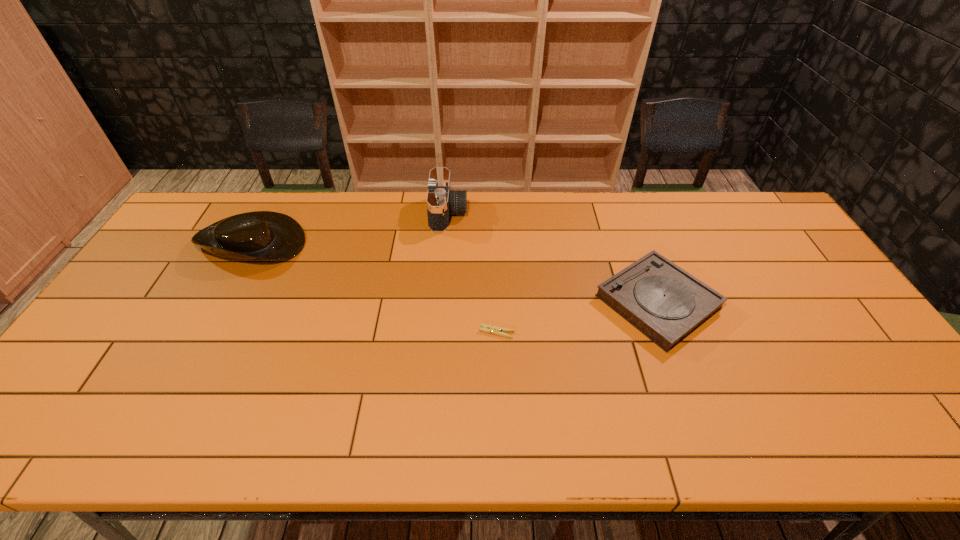
You are a GUI agent. You are given a task and a screenshot of the screen. Output one action in this format:
    pyautogui.click(x=<x>, y=<y>)
    Task: Click on the vacant space that's between the rightmost object and the third object from right to left
    
    Given the screenshot: What is the action you would take?
    pyautogui.click(x=553, y=258)

Where is `vacant point located between the shortest object and the cowboy hat`? Image resolution: width=960 pixels, height=540 pixels. vacant point located between the shortest object and the cowboy hat is located at coordinates (374, 286).

The width and height of the screenshot is (960, 540). I want to click on object that is the second nearest to the leftmost object, so click(486, 328).

At what (x,y) coordinates should I click in order to perform the action: click on object identified as the closest to the third object from left to right. Please return your answer as a coordinate pair (x, y). This screenshot has height=540, width=960. Looking at the image, I should click on (664, 302).

The image size is (960, 540). In order to click on free space in the image that satisfies the following two spatial constraints: 1. on the front-facing side of the tallest object; 2. on the right side of the third object from left to right in this screenshot , I will do `click(439, 332)`.

You are a GUI agent. You are given a task and a screenshot of the screen. Output one action in this format:
    pyautogui.click(x=<x>, y=<y>)
    Task: Click on the vacant area that satisfies the following two spatial constraints: 1. on the front-facing side of the second object from right to left; 2. on the right side of the camera
    
    Given the screenshot: What is the action you would take?
    tap(439, 332)

Where is `vacant area in the image that satisfies the following two spatial constraints: 1. on the front-facing side of the second object from left to right; 2. on the back side of the third object from left to right`? The height and width of the screenshot is (540, 960). vacant area in the image that satisfies the following two spatial constraints: 1. on the front-facing side of the second object from left to right; 2. on the back side of the third object from left to right is located at coordinates (439, 332).

The width and height of the screenshot is (960, 540). I want to click on blank space that satisfies the following two spatial constraints: 1. on the front side of the second object from right to left; 2. on the right side of the second tallest object, so click(203, 332).

Where is `vacant region that satisfies the following two spatial constraints: 1. on the front-facing side of the third tallest object; 2. on the left side of the camera`? vacant region that satisfies the following two spatial constraints: 1. on the front-facing side of the third tallest object; 2. on the left side of the camera is located at coordinates pos(442,302).

The width and height of the screenshot is (960, 540). I want to click on free space that satisfies the following two spatial constraints: 1. on the front-facing side of the tallest object; 2. on the right side of the clothespin, so click(439, 332).